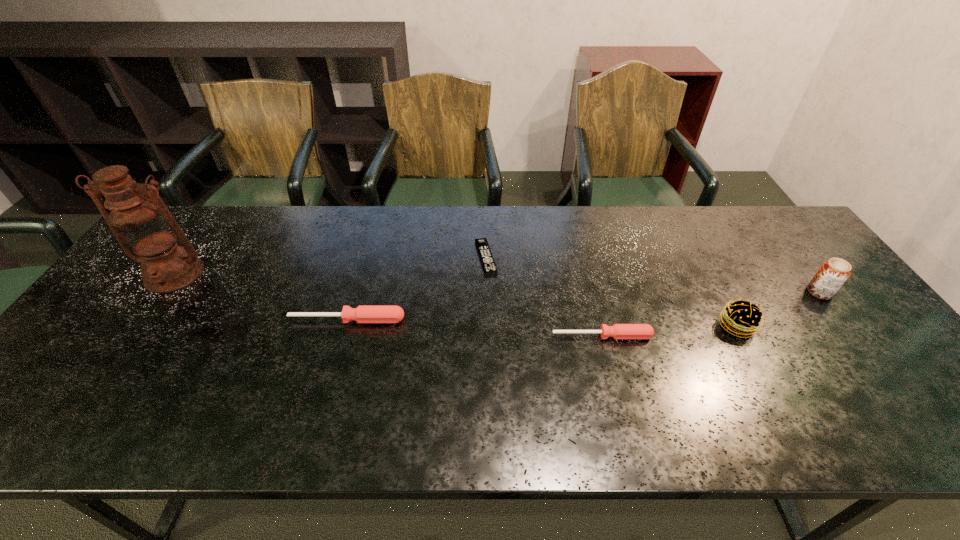
Identify the location of the fifth shortest object. (833, 273).

I want to click on the rightmost object, so click(x=833, y=273).

Image resolution: width=960 pixels, height=540 pixels. I want to click on vacant region located 0.380m on the back of the taller screwdriver, so click(373, 226).

This screenshot has width=960, height=540. Find the location of `free space located 0.170m on the right of the right screwdriver`. free space located 0.170m on the right of the right screwdriver is located at coordinates (719, 336).

Locate an element on the screen. vacant position located 0.160m on the right of the leftmost object is located at coordinates (265, 274).

The height and width of the screenshot is (540, 960). Find the location of `vacant point located on the left of the fourth shortest object`. vacant point located on the left of the fourth shortest object is located at coordinates (570, 326).

This screenshot has height=540, width=960. Identify the location of vacant space located 0.050m on the back of the fourth object from right to left. (486, 231).

Locate an element on the screen. free space located on the front of the beer can is located at coordinates (890, 384).

Where is `object located at the far edge`? object located at the far edge is located at coordinates (488, 263).

Where is `object that is at the left edge`? object that is at the left edge is located at coordinates (144, 227).